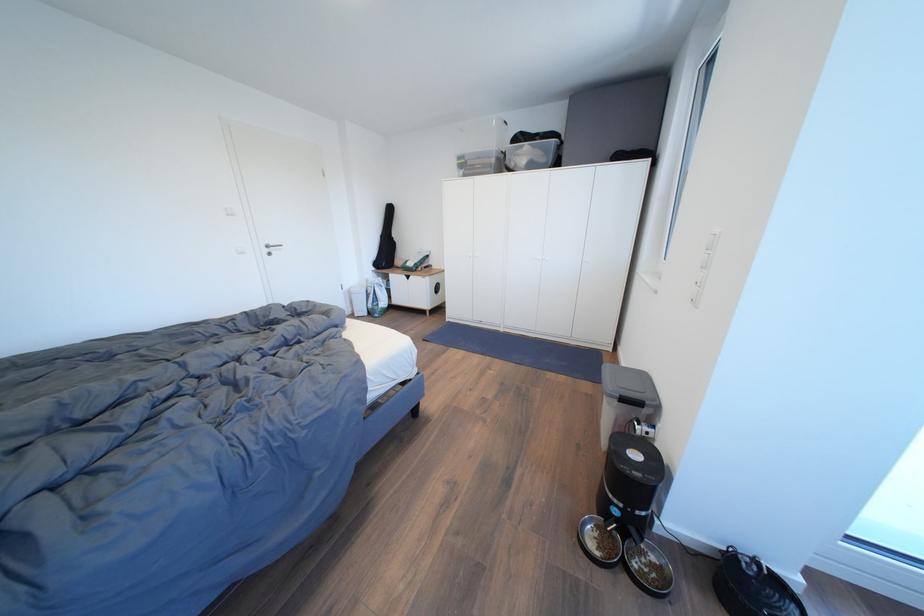
Find the location of a particular element. This screenshot has width=924, height=616. silver door handle is located at coordinates 273,246.